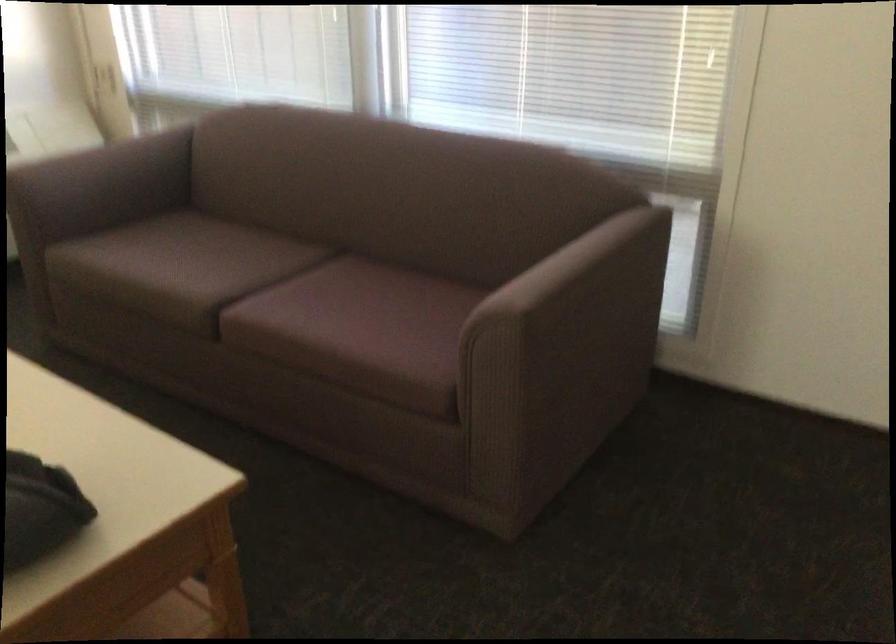
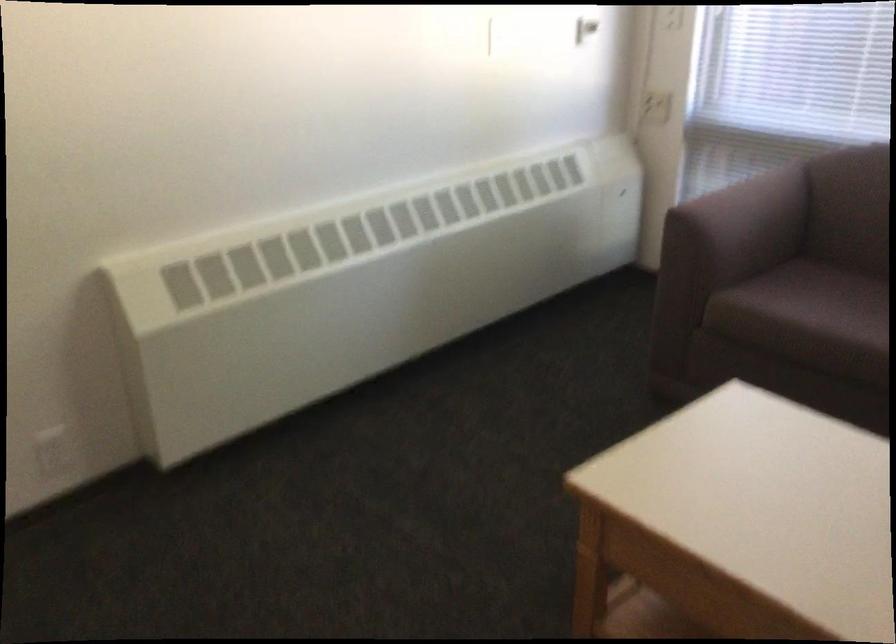
Where in the second image is the point corresponding to pixel 101 166 from the first image?

(752, 207)